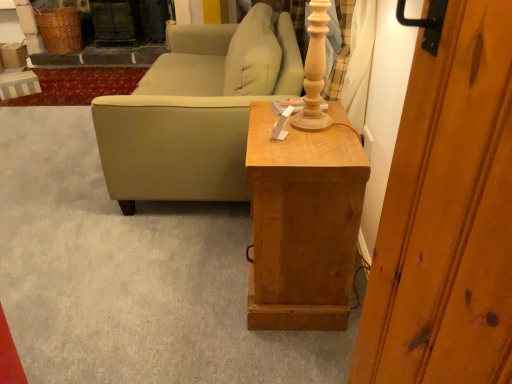
Image resolution: width=512 pixels, height=384 pixels. Describe the element at coordinates (190, 122) in the screenshot. I see `beige fabric couch at center` at that location.

In order to face beige fabric couch at center, should I rotate leftwards or rightwards?

You should look left and rotate roughly 6.013 degrees.

Locate an element on the screen. This screenshot has height=384, width=512. beige fabric couch at center is located at coordinates (190, 122).

The image size is (512, 384). What do you see at coordinates (303, 222) in the screenshot?
I see `wooden side table at center` at bounding box center [303, 222].

In order to click on wooden side table at center in this screenshot , I will do `click(303, 222)`.

Find the location of `beige fabric couch at center`. beige fabric couch at center is located at coordinates (190, 122).

Does beige fabric couch at center appear on the left side of wooden side table at center?

Yes, beige fabric couch at center is to the left of wooden side table at center.

Is beige fabric couch at center positioned before wooden side table at center?

No, beige fabric couch at center is behind wooden side table at center.

Considering the positions of points (247, 21) and (333, 279), is point (247, 21) closer to camera compared to point (333, 279)?

No, (247, 21) is further to viewer.

From the image's perspective, is beige fabric couch at center above wooden side table at center?

Yes.

From a real-world perspective, is beige fabric couch at center under wooden side table at center?

No.

Considering the relative sizes of beige fabric couch at center and wooden side table at center in the image provided, is beige fabric couch at center wider than wooden side table at center?

Yes.

Does beige fabric couch at center have a lesser height compared to wooden side table at center?

No, beige fabric couch at center is not shorter than wooden side table at center.

Is beige fabric couch at center bigger or smaller than wooden side table at center?

beige fabric couch at center is bigger than wooden side table at center.

Which is correct: beige fabric couch at center is inside wooden side table at center, or outside of it?

beige fabric couch at center is spatially situated outside wooden side table at center.

Is beige fabric couch at center touching wooden side table at center?

No, beige fabric couch at center is not next to wooden side table at center.

Is wooden side table at center at the back of beige fabric couch at center?

No, wooden side table at center is not at the back of beige fabric couch at center.

Locate an element on the screen. The image size is (512, 384). table that is in front of the beige fabric couch at center is located at coordinates (303, 222).

Considering the positions of objects wooden side table at center and beige fabric couch at center in the image provided, who is more to the right, wooden side table at center or beige fabric couch at center?

From the viewer's perspective, wooden side table at center appears more on the right side.

Considering their positions, is wooden side table at center located in front of or behind beige fabric couch at center?

Clearly, wooden side table at center is in front of beige fabric couch at center.

Looking at this image, which is farther, (260, 114) or (238, 195)?

Point (238, 195)

From the image's perspective, between wooden side table at center and beige fabric couch at center, who is located below?

wooden side table at center.

From a real-world perspective, which object stands above the other?

beige fabric couch at center, from a real-world perspective.

Which object is wider, wooden side table at center or beige fabric couch at center?

With larger width is beige fabric couch at center.

Considering the sizes of objects wooden side table at center and beige fabric couch at center in the image provided, who is shorter, wooden side table at center or beige fabric couch at center?

With less height is wooden side table at center.

Considering the sizes of objects wooden side table at center and beige fabric couch at center in the image provided, who is bigger, wooden side table at center or beige fabric couch at center?

beige fabric couch at center.

Does wooden side table at center contain beige fabric couch at center?

No, beige fabric couch at center is not inside wooden side table at center.

Is wooden side table at center next to beige fabric couch at center?

wooden side table at center and beige fabric couch at center are not in contact.

Could you tell me if wooden side table at center is facing beige fabric couch at center?

No, wooden side table at center does not turn towards beige fabric couch at center.

This screenshot has height=384, width=512. I want to click on table lying in front of the beige fabric couch at center, so click(x=303, y=222).

Identify the location of studio couch located on the left of wooden side table at center. Image resolution: width=512 pixels, height=384 pixels. (190, 122).

The image size is (512, 384). Find the location of `studio couch behind the wooden side table at center`. studio couch behind the wooden side table at center is located at coordinates (190, 122).